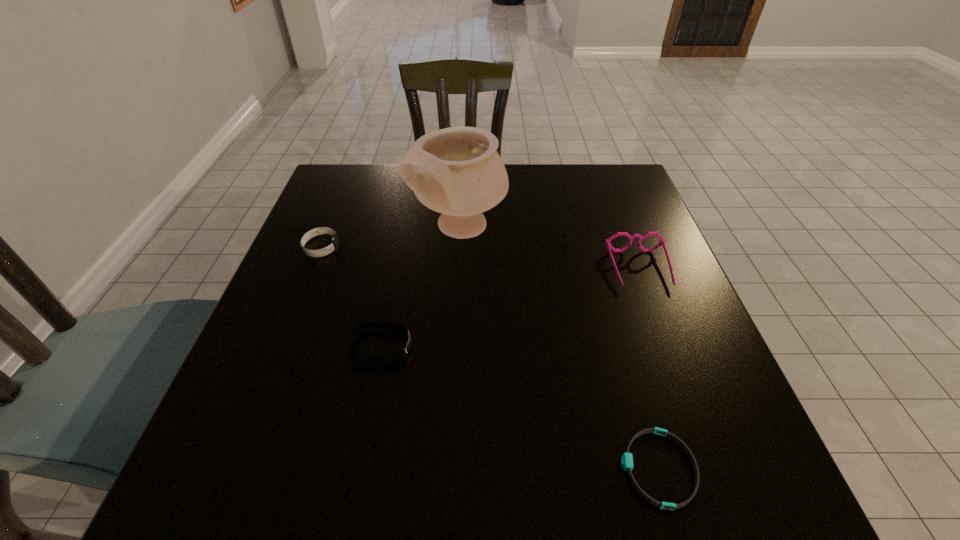
Where is `free area in between the nearest object and the second wristband from left to right`? The width and height of the screenshot is (960, 540). free area in between the nearest object and the second wristband from left to right is located at coordinates (519, 408).

Find the location of a particular element. vacant area that lies between the leftmost object and the second nearest wristband is located at coordinates (350, 297).

You are a GUI agent. You are given a task and a screenshot of the screen. Output one action in this format:
    pyautogui.click(x=<x>, y=<y>)
    Task: Click on the free space that is in between the tallest object and the leftmost wristband
    
    Given the screenshot: What is the action you would take?
    pyautogui.click(x=391, y=238)

I want to click on unoccupied area between the spectacles and the leftmost object, so pos(480,258).

Find the location of a particular element. The image size is (960, 540). free area in between the second wristband from left to right and the rightmost wristband is located at coordinates (519, 408).

The image size is (960, 540). I want to click on unoccupied area between the second wristband from left to right and the fourth shortest object, so click(510, 308).

Identify which object is located as the nearest to the leftmost wristband. Please provide its 2D coordinates. Your answer should be formatted as a tuple, i.e. [(x, y)], where the tuple contains the x and y coordinates of a point satisfying the conditions above.

[(458, 172)]

Image resolution: width=960 pixels, height=540 pixels. I want to click on object that is the nearest to the fourth shortest object, so click(458, 172).

At what (x,y) coordinates should I click in order to perform the action: click on wristband that stands as the closest to the second nearest wristband. Please return your answer as a coordinate pair (x, y). The height and width of the screenshot is (540, 960). Looking at the image, I should click on (333, 246).

Where is `wristband object that ranks as the second closest to the tallest wristband`? The width and height of the screenshot is (960, 540). wristband object that ranks as the second closest to the tallest wristband is located at coordinates (627, 460).